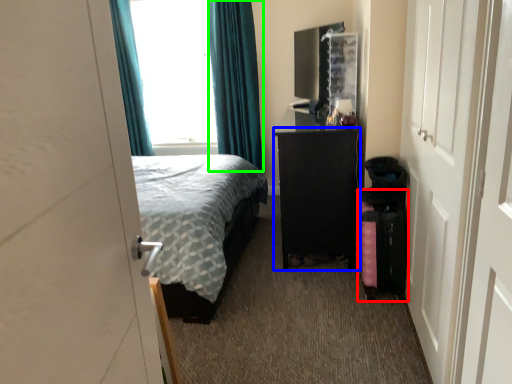
Question: Which is nearer to the luggage (highlighted by a red box)? furniture (highlighted by a blue box) or curtain (highlighted by a green box).

Choices:
 (A) furniture
 (B) curtain

Answer: (A)